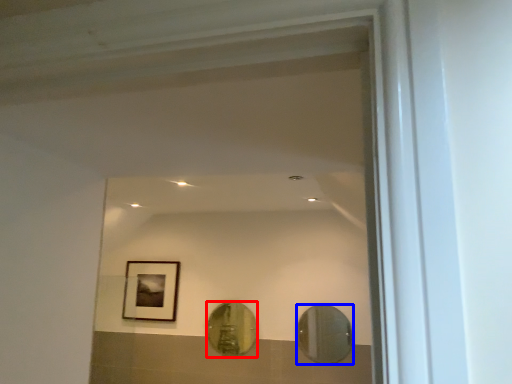
Question: Which object is closer to the camera taking this photo, mirror (highlighted by a red box) or mirror (highlighted by a blue box)?

Choices:
 (A) mirror
 (B) mirror

Answer: (B)